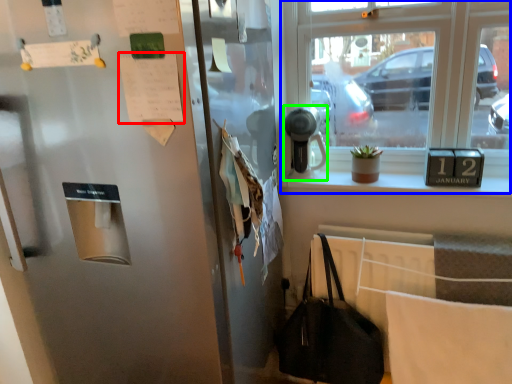
Question: Estimate the real-world distances between objects in this image. Which object is farther from paper (highlighted by a red box), window (highlighted by a blue box) or appliance (highlighted by a green box)?

Choices:
 (A) window
 (B) appliance

Answer: (A)